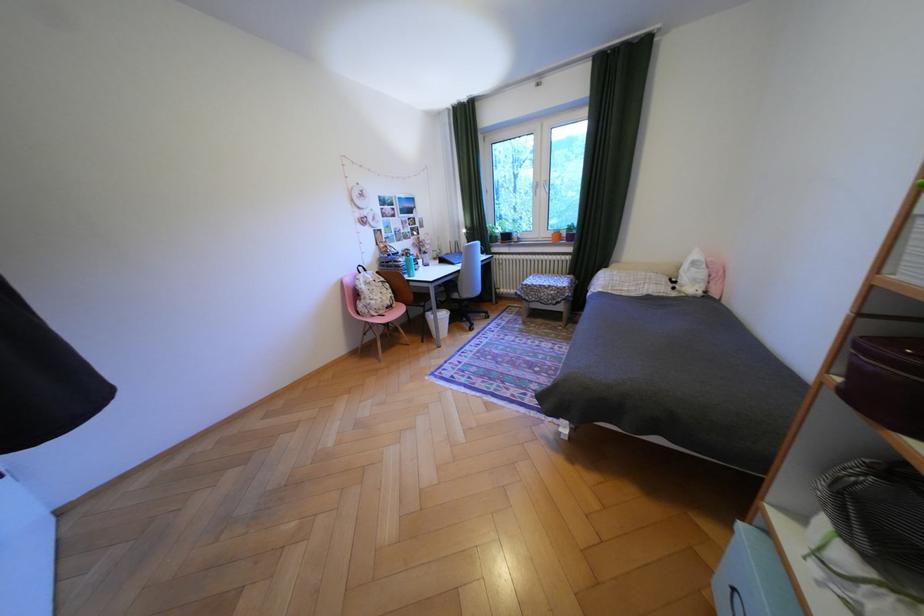
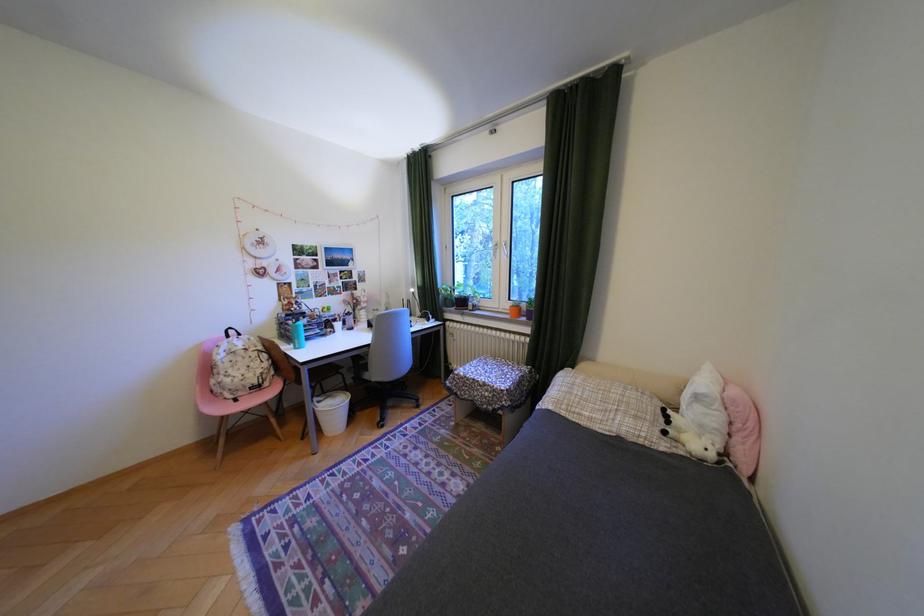
From the picture: What movement of the cameraman would produce the second image?

The movement direction of the cameraman is right, forward.